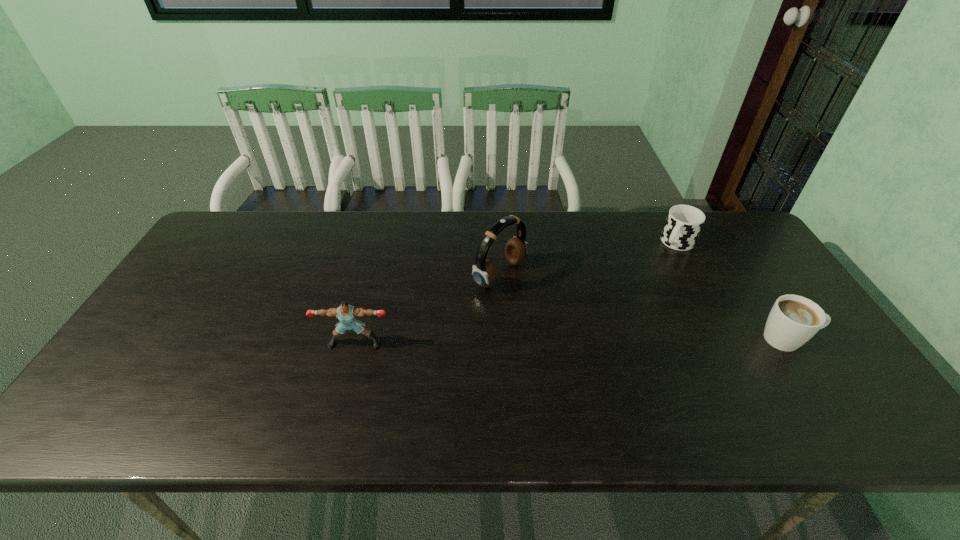
Where is `vacant space situated on the ear cup of the second object from left to right`? vacant space situated on the ear cup of the second object from left to right is located at coordinates (622, 348).

This screenshot has height=540, width=960. I want to click on free space located on the side of the second object from right to left with the handle, so click(625, 308).

Locate an element on the screen. The image size is (960, 540). blank space located 0.390m on the side of the second object from right to left with the handle is located at coordinates (612, 325).

In order to click on free space located 0.110m on the side of the second object from right to left with the handle in this screenshot , I will do `click(656, 271)`.

What are the coordinates of `headset that is at the far edge` in the screenshot? It's located at (484, 274).

Locate an element on the screen. cup that is at the far edge is located at coordinates (683, 224).

Locate an element on the screen. This screenshot has width=960, height=540. object at the right edge is located at coordinates (793, 320).

In order to click on blank space at the far edge of the desktop in this screenshot , I will do `click(296, 211)`.

Identify the location of vacant space at the near edge of the desktop. The image size is (960, 540). (327, 375).

Where is `vacant space at the left edge`? The image size is (960, 540). vacant space at the left edge is located at coordinates (120, 361).